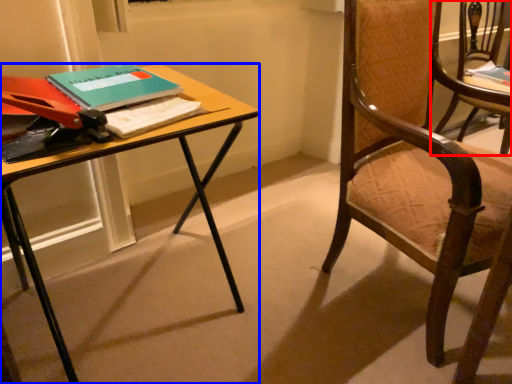
Question: Which point is closer to the camera, chair (highlighted by a red box) or desk (highlighted by a blue box)?

Choices:
 (A) chair
 (B) desk

Answer: (B)